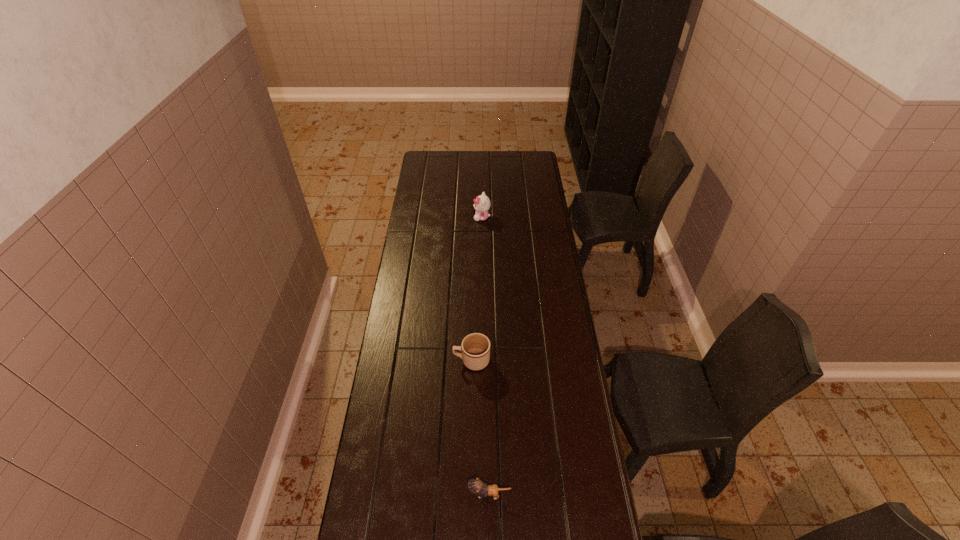
I want to click on the farther kitten, so click(x=482, y=203).

Identify the location of the taller kitten. This screenshot has height=540, width=960. (482, 203).

Image resolution: width=960 pixels, height=540 pixels. I want to click on mug, so click(475, 347).

Locate an element on the screen. the second nearest object is located at coordinates (475, 347).

Locate an element on the screen. This screenshot has height=540, width=960. the nearer kitten is located at coordinates (477, 486).

Where is `the shorter kitten`? the shorter kitten is located at coordinates (477, 486).

Locate an element on the screen. The image size is (960, 540). vacant area situated 0.120m on the front-facing side of the farthest object is located at coordinates (450, 217).

The image size is (960, 540). In order to click on free space located on the front-facing side of the farthest object in this screenshot , I will do `click(412, 217)`.

Find the location of a particular element. This screenshot has height=540, width=960. free point located 0.120m on the front-facing side of the farthest object is located at coordinates (450, 217).

The width and height of the screenshot is (960, 540). I want to click on free spot located on the side of the second shortest object with the handle, so pyautogui.click(x=411, y=361).